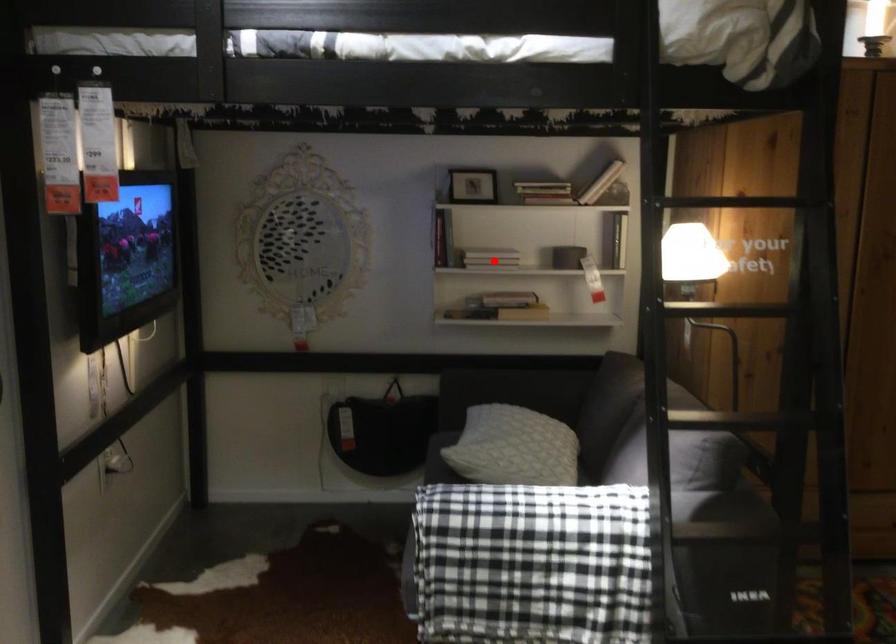
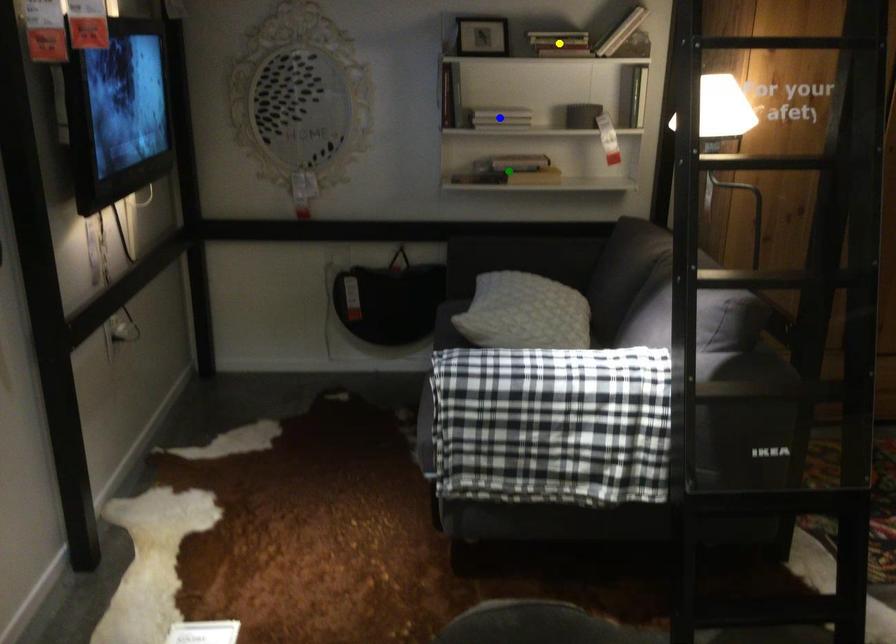
Question: I am providing you with two images of the same scene from different viewpoints. A red point is marked on the first image. You are given multiple points on the second image. Which spot in image 2 lines up with the point in image 1?

Choices:
 (A) blue point
 (B) yellow point
 (C) green point

Answer: (A)